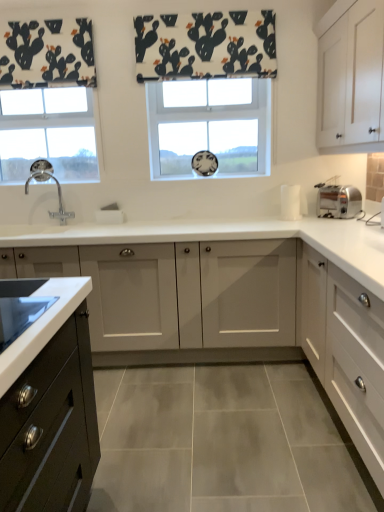
Question: From a real-world perspective, is white matte cabinet at upper right, the 1th cabinetry when ordered from top to bottom, on top of polished chrome faucet at left?

Choices:
 (A) no
 (B) yes

Answer: (B)

Question: Is polished chrome faucet at left at the back of white matte cabinet at upper right, the 1th cabinetry when ordered from top to bottom?

Choices:
 (A) no
 (B) yes

Answer: (A)

Question: Is white matte cabinet at upper right, acting as the fourth cabinetry starting from the bottom, at the left side of polished chrome faucet at left?

Choices:
 (A) yes
 (B) no

Answer: (B)

Question: Is white matte cabinet at upper right, the 1th cabinetry when ordered from top to bottom, further to camera compared to polished chrome faucet at left?

Choices:
 (A) no
 (B) yes

Answer: (A)

Question: Can you confirm if white matte cabinet at upper right, the 1th cabinetry when ordered from top to bottom, is smaller than polished chrome faucet at left?

Choices:
 (A) yes
 (B) no

Answer: (B)

Question: Is white matte cabinet at center, the 2th cabinetry in the top-to-bottom sequence, taller or shorter than white matte cabinet at right, the fourth cabinetry viewed from the top?

Choices:
 (A) tall
 (B) short

Answer: (A)

Question: In the image, is white matte cabinet at center, the third cabinetry ordered from the bottom, positioned in front of or behind white matte cabinet at right, the 1th cabinetry in the bottom-to-top sequence?

Choices:
 (A) front
 (B) behind

Answer: (B)

Question: Considering the positions of point (259, 311) and point (370, 443), is point (259, 311) closer or farther from the camera than point (370, 443)?

Choices:
 (A) closer
 (B) farther

Answer: (B)

Question: Is white matte cabinet at center, the 2th cabinetry in the top-to-bottom sequence, bigger or smaller than white matte cabinet at right, the 1th cabinetry in the bottom-to-top sequence?

Choices:
 (A) big
 (B) small

Answer: (A)

Question: In the image, is white matte cabinet at center, the third cabinetry ordered from the bottom, on the left side or the right side of clear glass window at left, placed as the 1th window when sorted from left to right?

Choices:
 (A) left
 (B) right

Answer: (B)

Question: From a real-world perspective, is white matte cabinet at center, the third cabinetry ordered from the bottom, physically located above or below clear glass window at left, marked as the 2th window in a right-to-left arrangement?

Choices:
 (A) above
 (B) below

Answer: (B)

Question: From the image's perspective, is white matte cabinet at center, the third cabinetry ordered from the bottom, above or below clear glass window at left, placed as the 1th window when sorted from left to right?

Choices:
 (A) above
 (B) below

Answer: (B)

Question: Is point (162, 322) closer or farther from the camera than point (4, 160)?

Choices:
 (A) farther
 (B) closer

Answer: (B)

Question: Which is correct: white matte cabinet at right, the 1th cabinetry in the bottom-to-top sequence, is inside white fabric with cactus print at upper center, or outside of it?

Choices:
 (A) outside
 (B) inside

Answer: (A)

Question: Is white matte cabinet at right, the 1th cabinetry in the bottom-to-top sequence, taller or shorter than white fabric with cactus print at upper center?

Choices:
 (A) short
 (B) tall

Answer: (B)